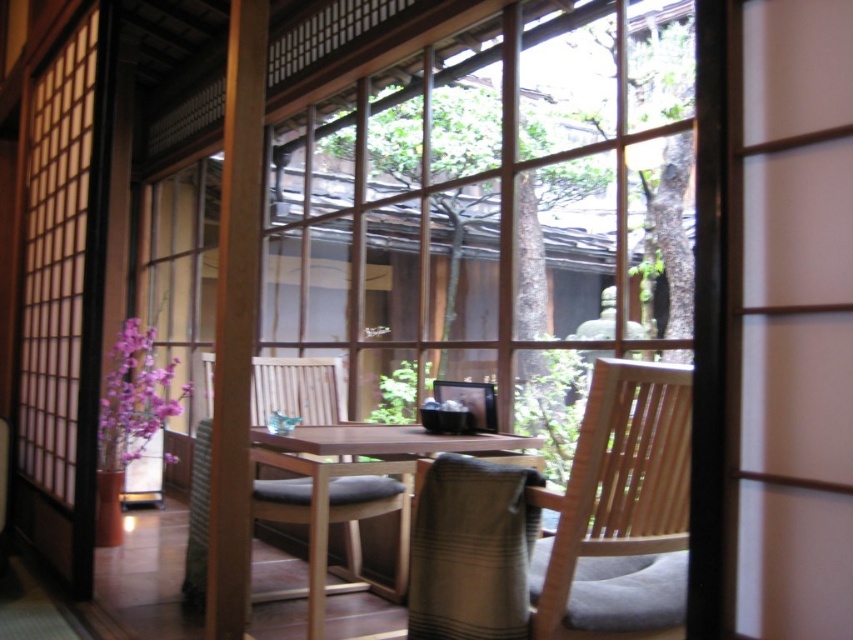
Can you confirm if translucent paper screen door at left is smaller than natural wood chair at center?

Incorrect, translucent paper screen door at left is not smaller in size than natural wood chair at center.

Which is behind, point (100, 216) or point (668, 620)?

The point (100, 216) is more distant.

Between point (90, 241) and point (569, 582), which one is positioned in front?

Point (569, 582)

Locate an element on the screen. The image size is (853, 640). translucent paper screen door at left is located at coordinates (62, 298).

Between wooden chair at center and wooden table at center, which one is positioned higher?

wooden table at center is above.

Does wooden chair at center appear on the right side of wooden table at center?

No, wooden chair at center is not to the right of wooden table at center.

Which is behind, point (291, 380) or point (317, 474)?

The point (291, 380) is behind.

Where is `wooden chair at center`? wooden chair at center is located at coordinates (334, 516).

In the scene shown: Who is shorter, translucent paper screen door at left or wooden table at center?

With less height is wooden table at center.

Does translucent paper screen door at left appear over wooden table at center?

Yes.

Image resolution: width=853 pixels, height=640 pixels. What do you see at coordinates (62, 298) in the screenshot?
I see `translucent paper screen door at left` at bounding box center [62, 298].

Locate an element on the screen. The width and height of the screenshot is (853, 640). translucent paper screen door at left is located at coordinates (62, 298).